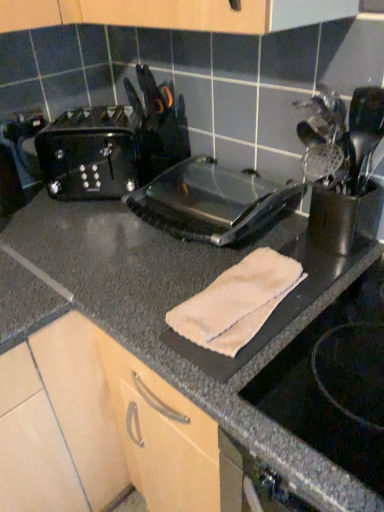
The width and height of the screenshot is (384, 512). What do you see at coordinates (91, 153) in the screenshot?
I see `black plastic toaster at left` at bounding box center [91, 153].

The width and height of the screenshot is (384, 512). Find the location of `beige cotton towel at center`. beige cotton towel at center is located at coordinates (237, 302).

Where is `satin silver utensil holder at right`? The height and width of the screenshot is (512, 384). satin silver utensil holder at right is located at coordinates (343, 165).

What do you see at coordinates (173, 306) in the screenshot? I see `granite black countertop at center` at bounding box center [173, 306].

Find the location of a particular element. Image resolution: width=384 pixels, height=512 pixels. black plastic toaster at left is located at coordinates (91, 153).

Does satin silver utensil holder at right have a larger size compared to white fabric at lower right?

No, satin silver utensil holder at right is not bigger than white fabric at lower right.

Is point (341, 115) in front of point (375, 469)?

No, it is behind (375, 469).

Considering the sizes of objects satin silver utensil holder at right and white fabric at lower right in the image provided, who is thinner, satin silver utensil holder at right or white fabric at lower right?

satin silver utensil holder at right is thinner.

Is the depth of satin silver utensil holder at right greater than that of white fabric at lower right?

Yes.

From a real-world perspective, which is physically above, transparent plastic toaster at center or white fabric at lower right?

transparent plastic toaster at center is physically above.

Would you say transparent plastic toaster at center is outside white fabric at lower right?

Absolutely, transparent plastic toaster at center is external to white fabric at lower right.

Between transparent plastic toaster at center and white fabric at lower right, which one appears on the right side from the viewer's perspective?

From the viewer's perspective, white fabric at lower right appears more on the right side.

From the image's perspective, is beige cotton towel at center above or below black plastic toaster at left?

beige cotton towel at center is situated lower than black plastic toaster at left in the image.

At what (x,y) coordinates should I click in order to perform the action: click on bath towel in front of the black plastic toaster at left. Please return your answer as a coordinate pair (x, y). The height and width of the screenshot is (512, 384). Looking at the image, I should click on (237, 302).

Which object is closer to the camera taking this photo, beige cotton towel at center or black plastic toaster at left?

beige cotton towel at center is in front.

How far apart are beige cotton towel at center and black plastic toaster at left?

The distance of beige cotton towel at center from black plastic toaster at left is 22.53 inches.

Is satin silver utensil holder at right at the right side of transparent plastic toaster at center?

Yes, satin silver utensil holder at right is to the right of transparent plastic toaster at center.

This screenshot has height=512, width=384. I want to click on appliance lying above the transparent plastic toaster at center (from the image's perspective), so (343, 165).

Considering the sizes of objects satin silver utensil holder at right and transparent plastic toaster at center in the image provided, who is shorter, satin silver utensil holder at right or transparent plastic toaster at center?

transparent plastic toaster at center is shorter.

Considering the sizes of objects satin silver utensil holder at right and transparent plastic toaster at center in the image provided, who is wider, satin silver utensil holder at right or transparent plastic toaster at center?

transparent plastic toaster at center is wider.

How far apart are black plastic toaster at left and white fabric at lower right?

The distance of black plastic toaster at left from white fabric at lower right is 29.75 inches.

Which object is positioned more to the right, black plastic toaster at left or white fabric at lower right?

white fabric at lower right is more to the right.

At what (x,y) coordinates should I click in order to perform the action: click on gas stove located below the black plastic toaster at left (from the image's perspective). Please return your answer as a coordinate pair (x, y). Looking at the image, I should click on (334, 382).

Is white fabric at lower right completely or partially inside black plastic toaster at left?

Definitely not — white fabric at lower right is not inside black plastic toaster at left.

What's the angular difference between granite black countertop at center and transparent plastic toaster at center's facing directions?

The facing directions of granite black countertop at center and transparent plastic toaster at center are 0.195 degrees apart.

Is granite black countertop at center positioned with its back to transparent plastic toaster at center?

That's not correct — granite black countertop at center is not looking away from transparent plastic toaster at center.

From a real-world perspective, relative to transparent plastic toaster at center, is granite black countertop at center vertically above or below?

In terms of real-world spatial position, granite black countertop at center is below transparent plastic toaster at center.

Choose the correct answer: Is granite black countertop at center inside transparent plastic toaster at center or outside it?

granite black countertop at center cannot be found inside transparent plastic toaster at center.

Measure the distance between beige cotton towel at center and granite black countertop at center.

beige cotton towel at center is 5.42 inches from granite black countertop at center.

Considering the positions of points (258, 254) and (317, 472), is point (258, 254) farther from camera compared to point (317, 472)?

Yes, point (258, 254) is farther from viewer.

Is beige cotton towel at center smaller than granite black countertop at center?

Correct, beige cotton towel at center occupies less space than granite black countertop at center.

This screenshot has height=512, width=384. I want to click on appliance behind the white fabric at lower right, so click(x=343, y=165).

Locate an element on the screen. The height and width of the screenshot is (512, 384). gas stove lying in front of the transparent plastic toaster at center is located at coordinates (334, 382).

Which object lies further to the anchor point white fabric at lower right, beige cotton towel at center or transparent plastic toaster at center?

Among the two, transparent plastic toaster at center is located further to white fabric at lower right.

Which object lies nearer to the anchor point beige cotton towel at center, transparent plastic toaster at center or satin silver utensil holder at right?

satin silver utensil holder at right lies closer to beige cotton towel at center than the other object.

Considering their positions, is satin silver utensil holder at right positioned further to transparent plastic toaster at center than beige cotton towel at center?

Among the two, beige cotton towel at center is located further to transparent plastic toaster at center.

Which object lies further to the anchor point beige cotton towel at center, black plastic toaster at left or satin silver utensil holder at right?

Among the two, black plastic toaster at left is located further to beige cotton towel at center.

Looking at the image, which one is located further to white fabric at lower right, beige cotton towel at center or granite black countertop at center?

granite black countertop at center lies further to white fabric at lower right than the other object.

Based on their spatial positions, is white fabric at lower right or beige cotton towel at center further from black plastic toaster at left?

The object further to black plastic toaster at left is white fabric at lower right.

Which object lies further to the anchor point transparent plastic toaster at center, black plastic toaster at left or granite black countertop at center?

Based on the image, black plastic toaster at left appears to be further to transparent plastic toaster at center.

Considering their positions, is black plastic toaster at left positioned closer to beige cotton towel at center than transparent plastic toaster at center?

transparent plastic toaster at center lies closer to beige cotton towel at center than the other object.

The image size is (384, 512). Identify the location of bath towel between black plastic toaster at left and white fabric at lower right vertically. (237, 302).

Find the location of a particular element. Image resolution: width=384 pixels, height=512 pixels. kitchen appliance between satin silver utensil holder at right and white fabric at lower right from top to bottom is located at coordinates point(210,202).

Locate an element on the screen. The image size is (384, 512). countertop between satin silver utensil holder at right and white fabric at lower right in the vertical direction is located at coordinates (173, 306).

Identify the location of bath towel between black plastic toaster at left and granite black countertop at center vertically. The image size is (384, 512). (x=237, y=302).